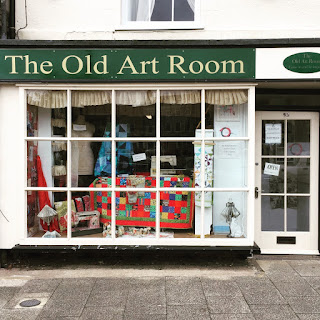
Find the location of `quilt`. quilt is located at coordinates (142, 210), (104, 153), (61, 208), (80, 204), (86, 202).